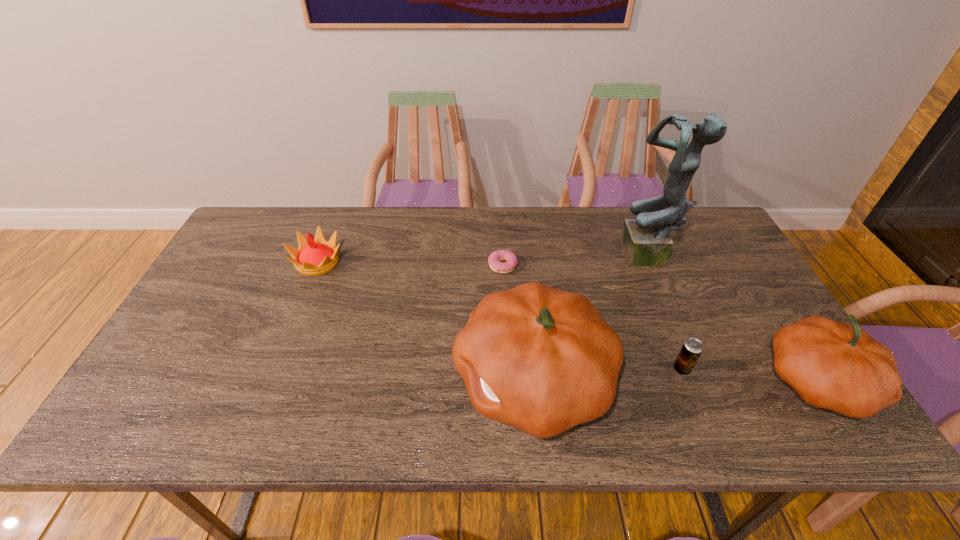
With all pumpkins evenly spaced, where should an extra pumpkin be placed on the left to continue the pattern? Please point out a vacant space. Please provide its 2D coordinates. Your answer should be formatted as a tuple, i.e. [(x, y)], where the tuple contains the x and y coordinates of a point satisfying the conditions above.

[(250, 378)]